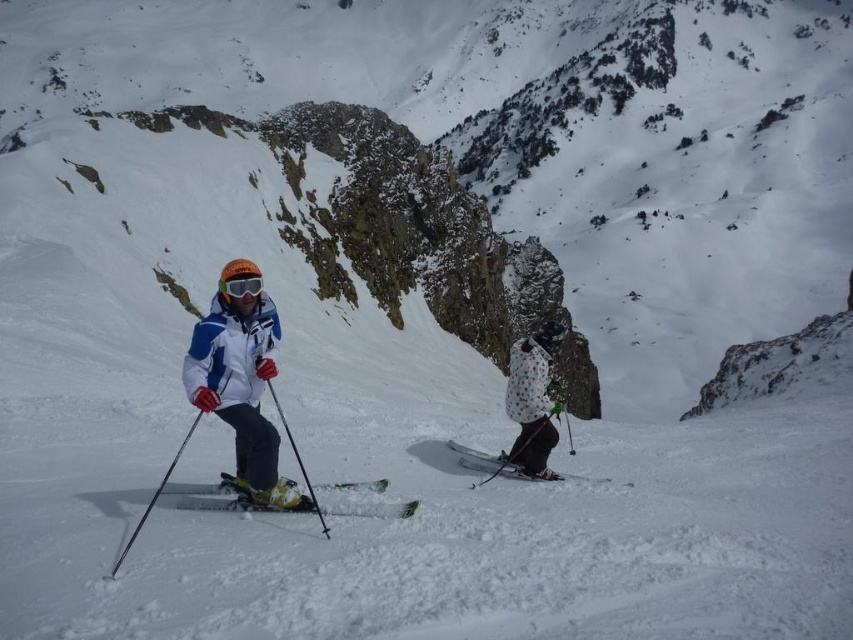
Who is more distant from viewer, (242, 435) or (575, 474)?

Point (575, 474)

Is white matte jacket at center positioned in front of white matte ski at center?

Yes, it is in front of white matte ski at center.

Is point (248, 468) in front of point (596, 481)?

Yes.

Locate an element on the screen. Image resolution: width=853 pixels, height=640 pixels. white matte jacket at center is located at coordinates (241, 384).

Does white dotted jacket at center appear on the left side of green matte ski at center?

Incorrect, white dotted jacket at center is not on the left side of green matte ski at center.

Is point (537, 337) positioned after point (317, 490)?

Yes, point (537, 337) is behind point (317, 490).

This screenshot has height=640, width=853. What are the coordinates of `white dotted jacket at center` in the screenshot? It's located at 532,400.

This screenshot has height=640, width=853. In order to click on white dotted jacket at center in this screenshot , I will do `click(532, 400)`.

Does matte black ski pole at center appear on the right side of transparent orange goggles at center?

Yes, matte black ski pole at center is to the right of transparent orange goggles at center.

Who is positioned more to the right, matte black ski pole at center or transparent orange goggles at center?

matte black ski pole at center

I want to click on matte black ski pole at center, so click(299, 460).